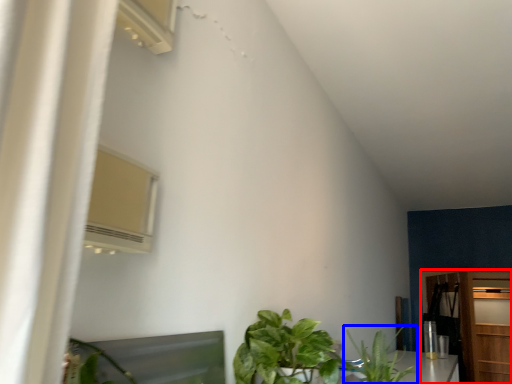
Question: Which of the following is the closest to the observer, dresser (highlighted by a red box) or houseplant (highlighted by a blue box)?

Choices:
 (A) dresser
 (B) houseplant

Answer: (B)